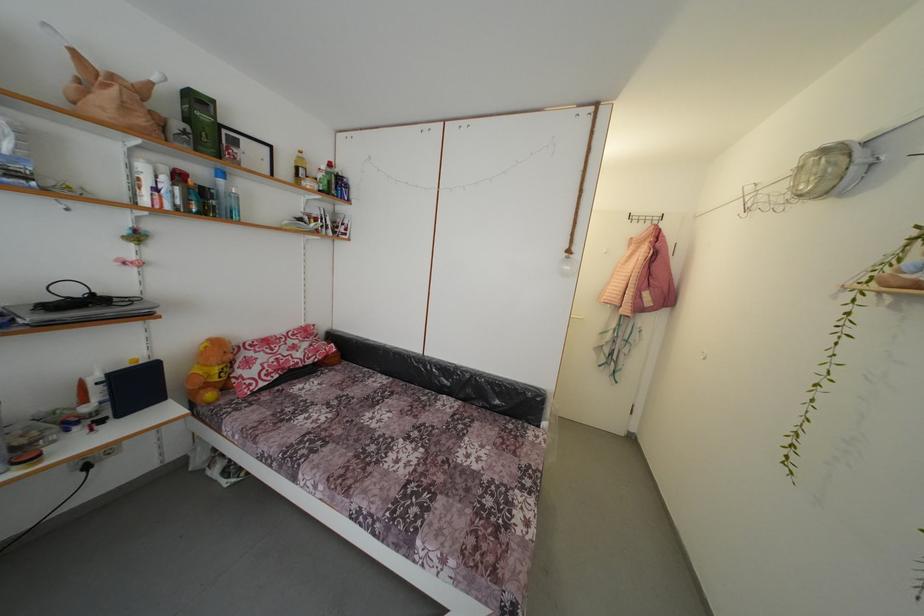
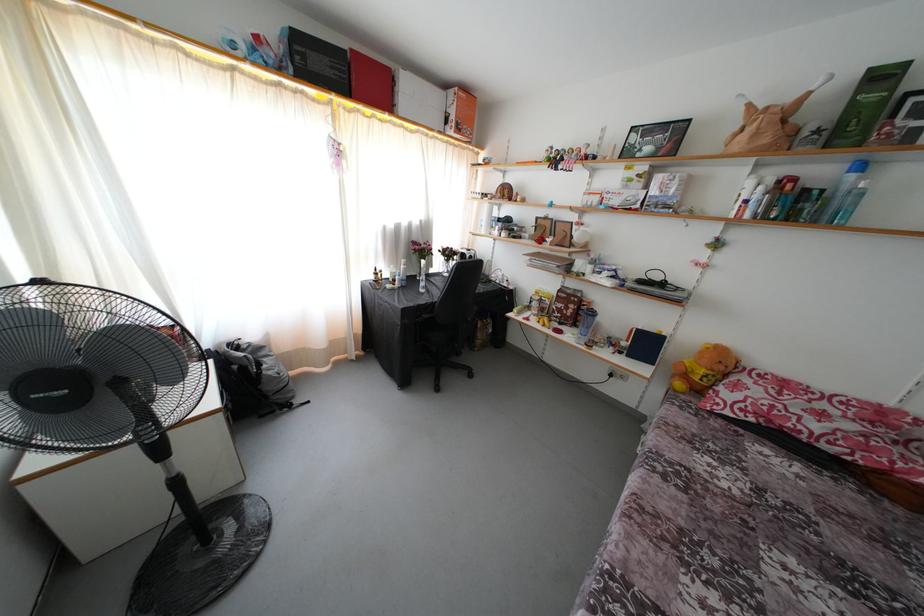
Locate, in the second image, the point that corresponds to pixel 236 362 in the first image.

(726, 373)